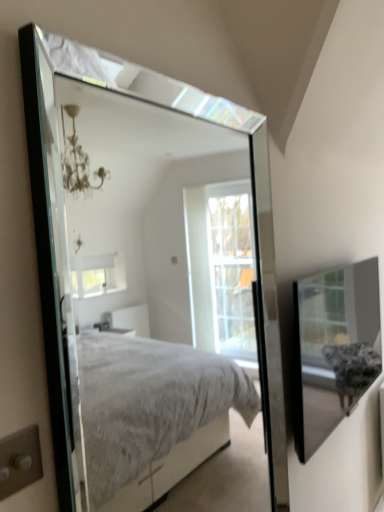
Question: From a real-world perspective, is clear glass box at upper right above or below clear glass mirror at upper center?

Choices:
 (A) below
 (B) above

Answer: (A)

Question: Does point (359, 366) appear closer or farther from the camera than point (117, 448)?

Choices:
 (A) closer
 (B) farther

Answer: (A)

Question: Considering the positions of clear glass box at upper right and clear glass mirror at upper center in the image, is clear glass box at upper right wider or thinner than clear glass mirror at upper center?

Choices:
 (A) thin
 (B) wide

Answer: (B)

Question: In terms of height, does clear glass mirror at upper center look taller or shorter compared to clear glass box at upper right?

Choices:
 (A) short
 (B) tall

Answer: (B)

Question: Is clear glass mirror at upper center to the left or to the right of clear glass box at upper right in the image?

Choices:
 (A) right
 (B) left

Answer: (B)

Question: From the image's perspective, is clear glass mirror at upper center above or below clear glass box at upper right?

Choices:
 (A) above
 (B) below

Answer: (A)

Question: Is clear glass mirror at upper center inside the boundaries of clear glass box at upper right, or outside?

Choices:
 (A) inside
 (B) outside

Answer: (B)